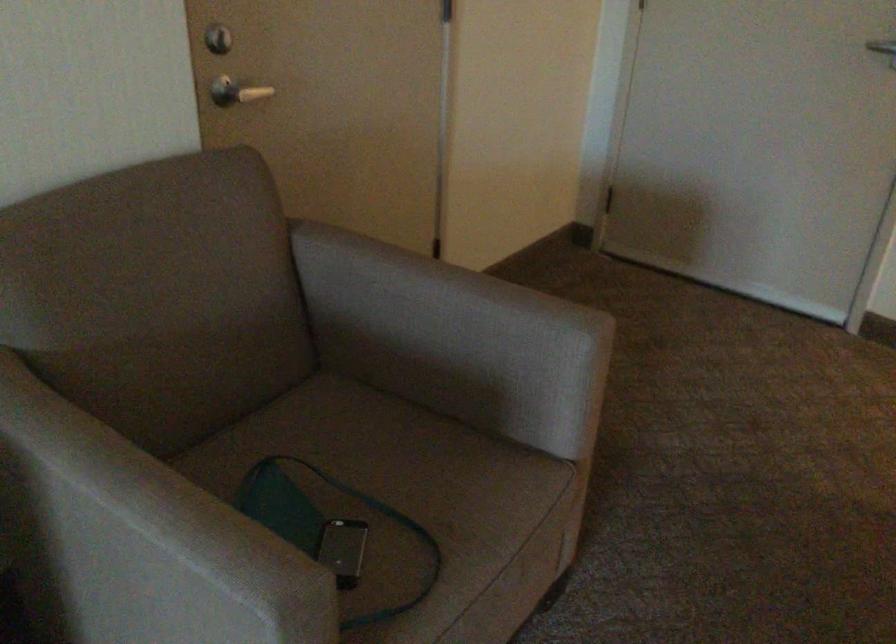
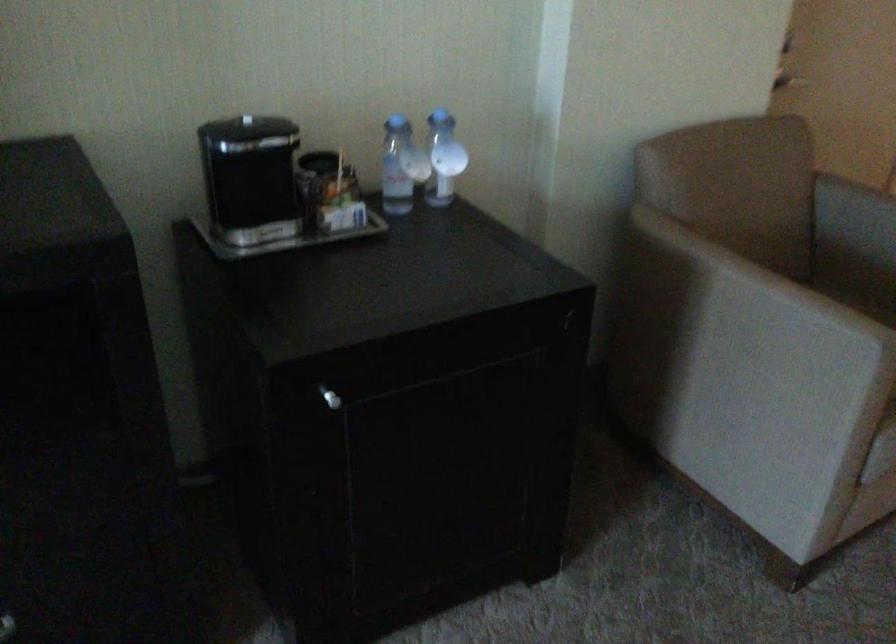
The point at (110, 554) is marked in the first image. Where is the corresponding point in the second image?

(739, 319)